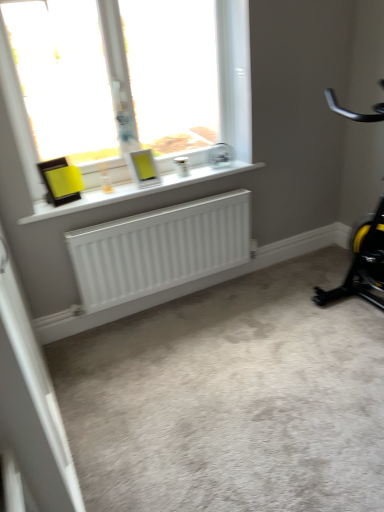
Find the location of `vacant region under white matte radiator at lower center (from a real-world perspective)`. vacant region under white matte radiator at lower center (from a real-world perspective) is located at coordinates (193, 295).